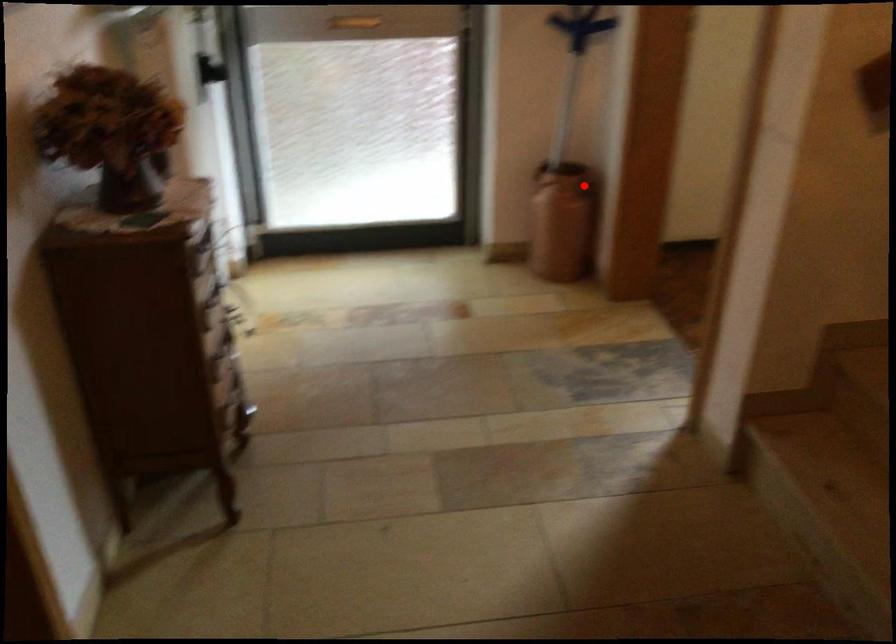
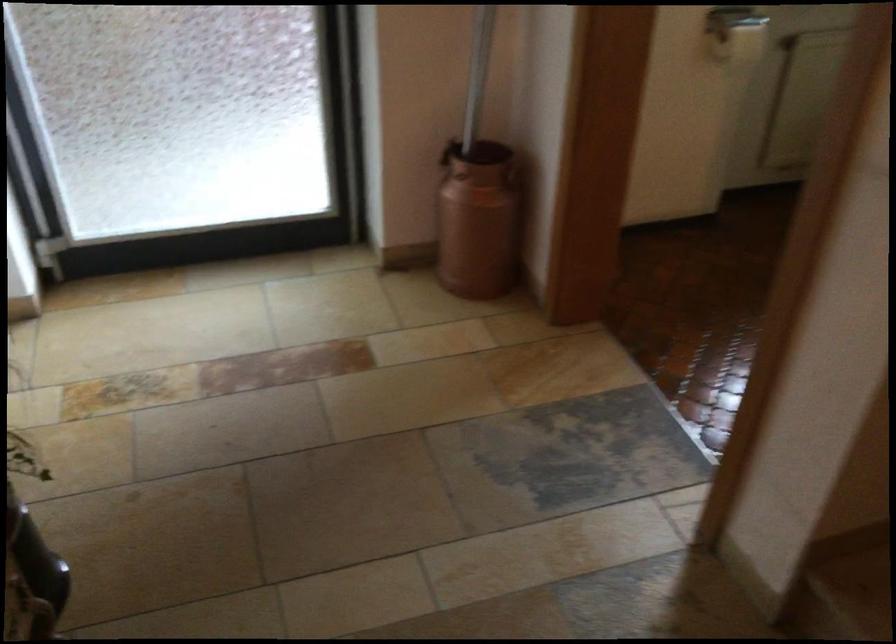
Question: I am providing you with two images of the same scene from different viewpoints. Image1 has a red point marked. In image2, the corresponding 3D location appears at what relative position? Reply with the corresponding letter.

Choices:
 (A) Closer
 (B) Farther

Answer: (A)